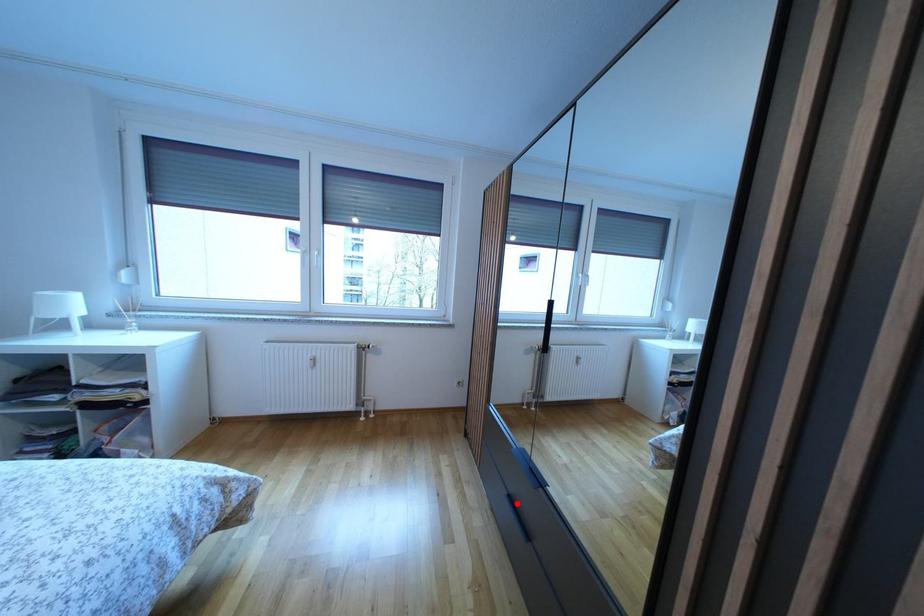
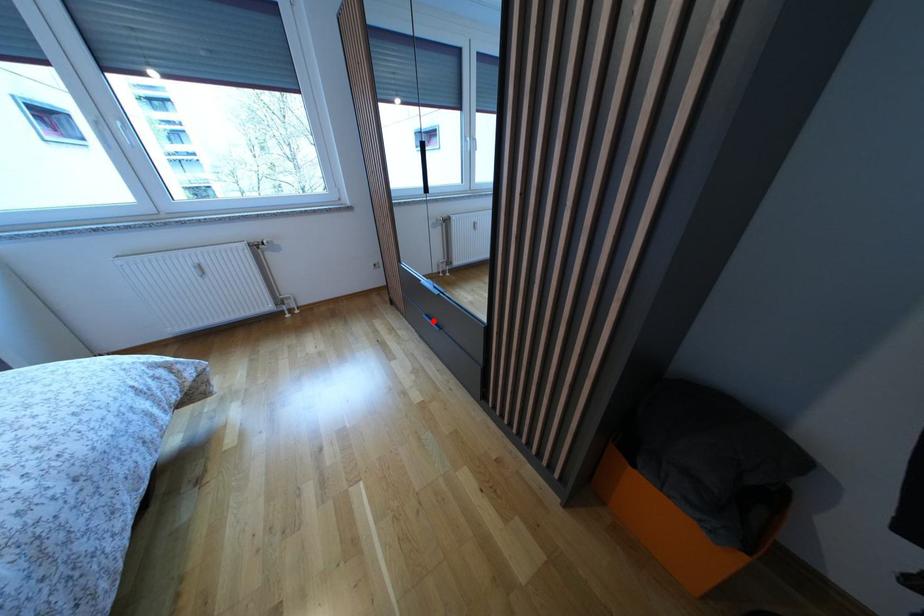
I am providing you with two images of the same scene from different viewpoints. A red point is marked on the first image and another point is marked on the second image. Do the highlighted points in image1 and image2 indicate the same real-world spot?

Yes